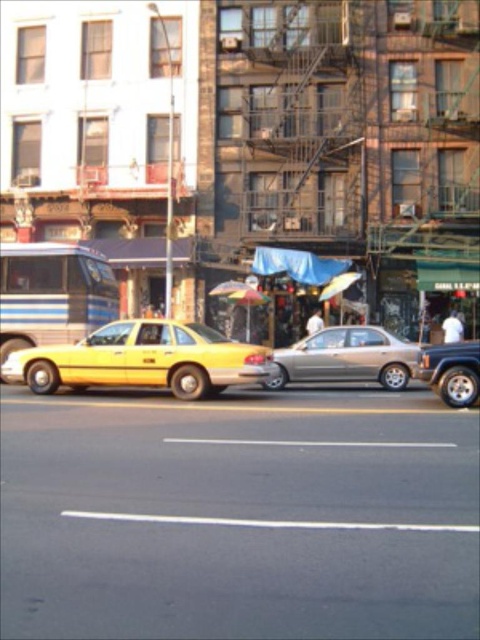
Looking at this image, you are a delivery person who needs to park your delivery van, which is 2 meters wide, between the metallic silver suv at right and the translucent plastic umbrella at center. Based on the scene, can your van fit in the space between them?

The metallic silver suv at right is narrower than the translucent plastic umbrella at center. However, the description only provides a comparison of their widths but does not specify the actual distance between them. Without knowing the exact space between the two objects, it is impossible to determine if the van can fit.

You are a delivery person who needs to move a 15 feet long ladder between the shiny yellow taxi at center and the satin gold sedan at center. Is there enough space to move the ladder horizontally without tilting it?

The shiny yellow taxi at center and satin gold sedan at center are 20.34 feet apart from each other. Since the ladder is 15 feet long, there is sufficient space to move the ladder horizontally without tilting it as the distance between them is greater than the ladder length.

You are a pedestrian standing on the sidewalk and see both the shiny yellow taxi at center and the satin gold sedan at center. Which vehicle is closer to the left side of the street?

The shiny yellow taxi at center is positioned on the left side of the satin gold sedan at center, so it is closer to the left side of the street.